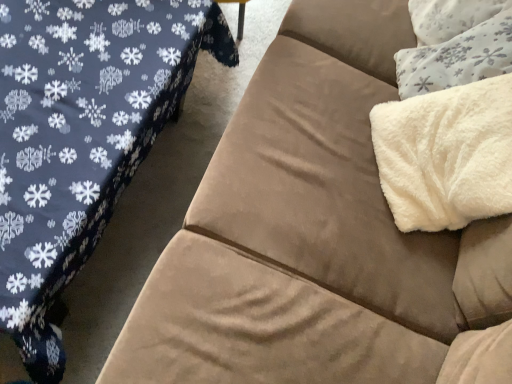
Question: Considering the relative sizes of suede couch at right and white fluffy throw pillow at upper right in the image provided, is suede couch at right shorter than white fluffy throw pillow at upper right?

Choices:
 (A) yes
 (B) no

Answer: (A)

Question: Considering the relative sizes of suede couch at right and white fluffy throw pillow at upper right in the image provided, is suede couch at right taller than white fluffy throw pillow at upper right?

Choices:
 (A) yes
 (B) no

Answer: (B)

Question: Considering the relative positions of suede couch at right and white fluffy throw pillow at upper right in the image provided, is suede couch at right behind white fluffy throw pillow at upper right?

Choices:
 (A) no
 (B) yes

Answer: (A)

Question: Is suede couch at right aimed at white fluffy throw pillow at upper right?

Choices:
 (A) yes
 (B) no

Answer: (B)

Question: Is suede couch at right turned away from white fluffy throw pillow at upper right?

Choices:
 (A) yes
 (B) no

Answer: (A)

Question: Does suede couch at right appear on the right side of white fluffy throw pillow at upper right?

Choices:
 (A) yes
 (B) no

Answer: (B)

Question: From a real-world perspective, is white fluffy throw pillow at upper right beneath white fluffy blanket at upper right?

Choices:
 (A) no
 (B) yes

Answer: (B)

Question: Considering the relative sizes of white fluffy throw pillow at upper right and white fluffy blanket at upper right in the image provided, is white fluffy throw pillow at upper right taller than white fluffy blanket at upper right?

Choices:
 (A) yes
 (B) no

Answer: (B)

Question: Does white fluffy throw pillow at upper right have a greater width compared to white fluffy blanket at upper right?

Choices:
 (A) yes
 (B) no

Answer: (A)

Question: Can you confirm if white fluffy throw pillow at upper right is positioned to the right of white fluffy blanket at upper right?

Choices:
 (A) yes
 (B) no

Answer: (A)

Question: Is white fluffy blanket at upper right at the back of white fluffy throw pillow at upper right?

Choices:
 (A) yes
 (B) no

Answer: (B)

Question: From a real-world perspective, does white fluffy throw pillow at upper right stand above white fluffy blanket at upper right?

Choices:
 (A) no
 (B) yes

Answer: (A)

Question: Are white fluffy blanket at upper right and white fluffy throw pillow at upper right making contact?

Choices:
 (A) no
 (B) yes

Answer: (A)